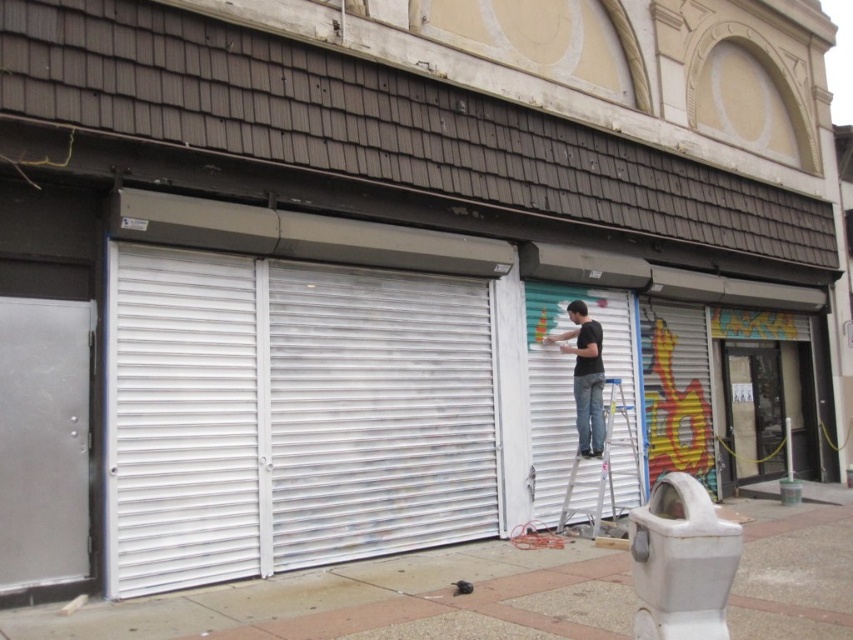
Question: Which point is closer to the camera?

Choices:
 (A) (596, 497)
 (B) (128, 410)
 (C) (180, 396)

Answer: (B)

Question: Which point is farther to the camera?

Choices:
 (A) white corrugated metal at left
 (B) metallic silver ladder at center
 (C) brushed metal garage door at left

Answer: (B)

Question: Is brushed metal garage door at left bigger than multicolored painted metal shutter at right?

Choices:
 (A) no
 (B) yes

Answer: (A)

Question: Does brushed metal garage door at left appear over black matte shirt at center?

Choices:
 (A) yes
 (B) no

Answer: (B)

Question: Which object appears closest to the camera in this image?

Choices:
 (A) transparent glass door at center
 (B) white metallic shutter at left

Answer: (B)

Question: Does transparent glass door at center appear over metallic silver ladder at center?

Choices:
 (A) yes
 (B) no

Answer: (B)